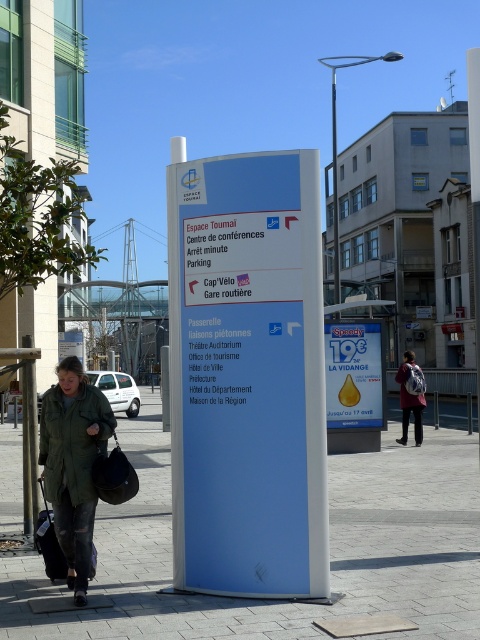
You are a tourist in the city and you want to read the blue plastic sign at center. However, your dark green fabric coat at center is blocking your view. Can you see the entire sign by lifting your coat?

The blue plastic sign at center is taller than the dark green fabric coat at center. By lifting the coat, you can see the entire sign since it is taller and not completely obscured by the coat.

You are standing in the urban scene and want to place a small map on the ground. The map needs to be positioned exactly where the maroon fabric backpack at center is currently located. Is there enough space to place the map without overlapping any other objects?

The maroon fabric backpack at center is located at point (x=409, y=401), so yes, there is enough space to place the map there as long as no other objects are at that coordinate.